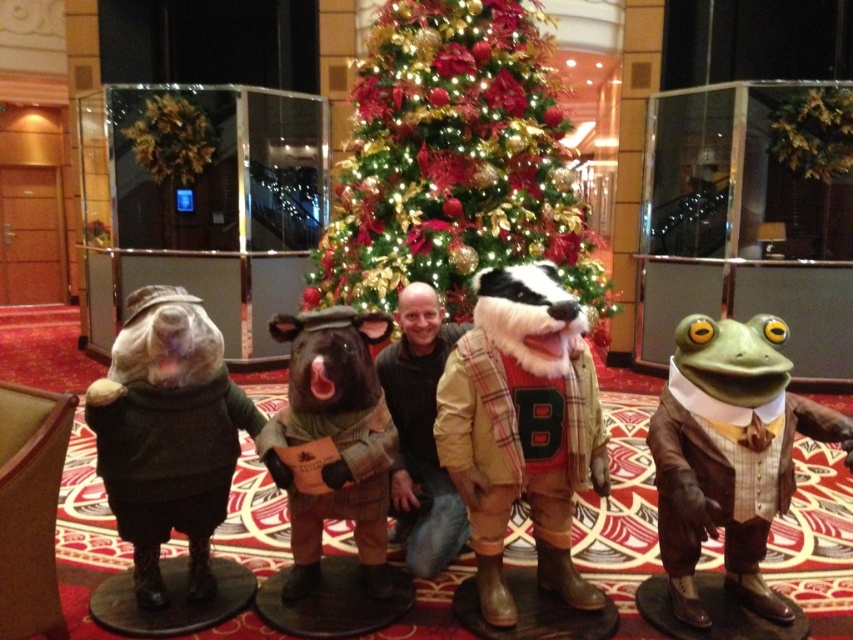
Consider the image. You are organizing a holiday photo shoot and need to place a decorative wreath between the matte brown plush bear at left and the green fabric frog at center. Based on their widths, which side of the wreath should you align with to ensure it fits properly?

The matte brown plush bear at left might be wider than the green fabric frog at center, so aligning the wreath closer to the matte brown plush bear at left would provide more space for it to fit properly.

You are standing in the festive indoor setting and want to take a photo of the green shiny christmas tree at center. Given that you are positioned at point A, which is to the left of the tree, should you move to your right or left to frame the tree better?

Since the green shiny christmas tree at center is located at point (456, 163), if you are positioned to the left of it, moving to your right would align you more centrally with the tree for a better frame.

You are an interior designer planning to place a new sofa in the hotel lobby. The sofa will be positioned in front of the green shiny christmas tree at center and the matte brown plush bear at left. Which object will appear taller when viewed from the sofa?

The green shiny christmas tree at center will appear taller than the matte brown plush bear at left because it has a greater height compared to the bear.